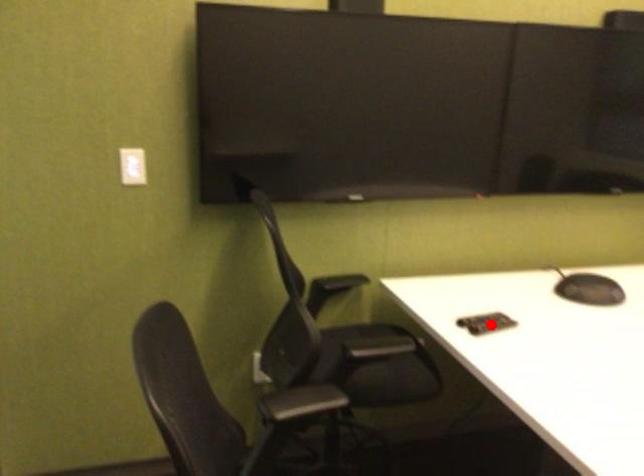
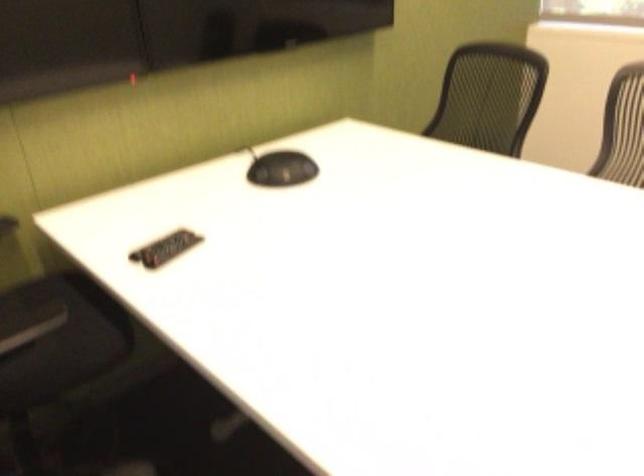
Question: I am providing you with two images of the same scene from different viewpoints. Given a red point in image1, look at the same physical point in image2. Is it:

Choices:
 (A) Closer to the viewpoint
 (B) Farther from the viewpoint

Answer: (A)